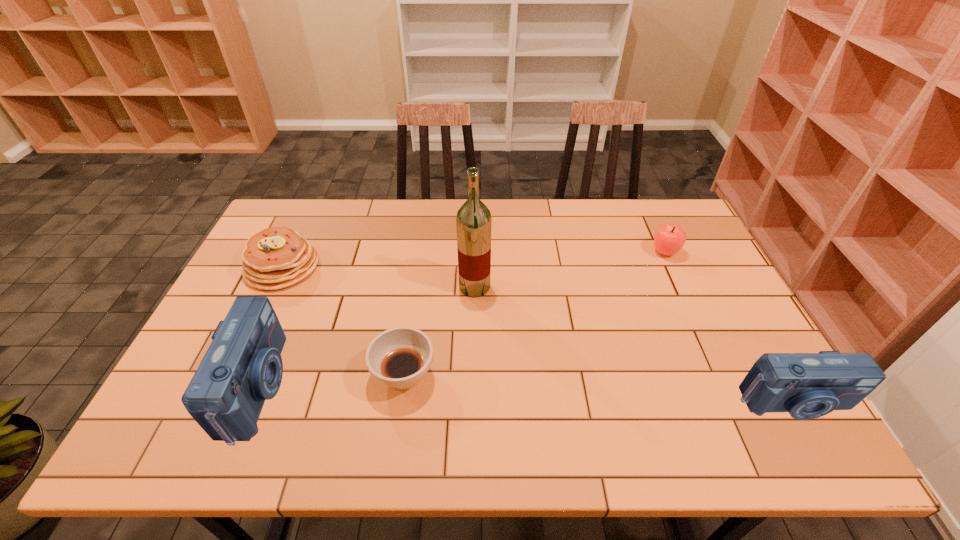
Find the location of a particular element. The height and width of the screenshot is (540, 960). object that is at the near left corner is located at coordinates (243, 367).

The width and height of the screenshot is (960, 540). I want to click on object at the near right corner, so click(807, 385).

In the image, there is a desktop. At what (x,y) coordinates should I click in order to perform the action: click on vacant space at the far edge. Please return your answer as a coordinate pair (x, y). This screenshot has width=960, height=540. Looking at the image, I should click on (393, 206).

In the image, there is a desktop. At what (x,y) coordinates should I click in order to perform the action: click on free region at the near edge. Please return your answer as a coordinate pair (x, y). The height and width of the screenshot is (540, 960). Looking at the image, I should click on (670, 395).

The height and width of the screenshot is (540, 960). In order to click on free region at the right edge in this screenshot , I will do `click(725, 319)`.

I want to click on vacant space at the near right corner of the desktop, so click(x=740, y=397).

At what (x,y) coordinates should I click in order to perform the action: click on empty location between the apple and the right camera. Please return your answer as a coordinate pair (x, y). Looking at the image, I should click on (729, 327).

Locate an element on the screen. Image resolution: width=960 pixels, height=540 pixels. free area in between the fourth object from right to left and the apple is located at coordinates [535, 314].

The width and height of the screenshot is (960, 540). What are the coordinates of `empty space that is in between the shorter camera and the shortest object` in the screenshot? It's located at (599, 389).

Locate an element on the screen. Image resolution: width=960 pixels, height=540 pixels. free space between the right camera and the apple is located at coordinates [729, 327].